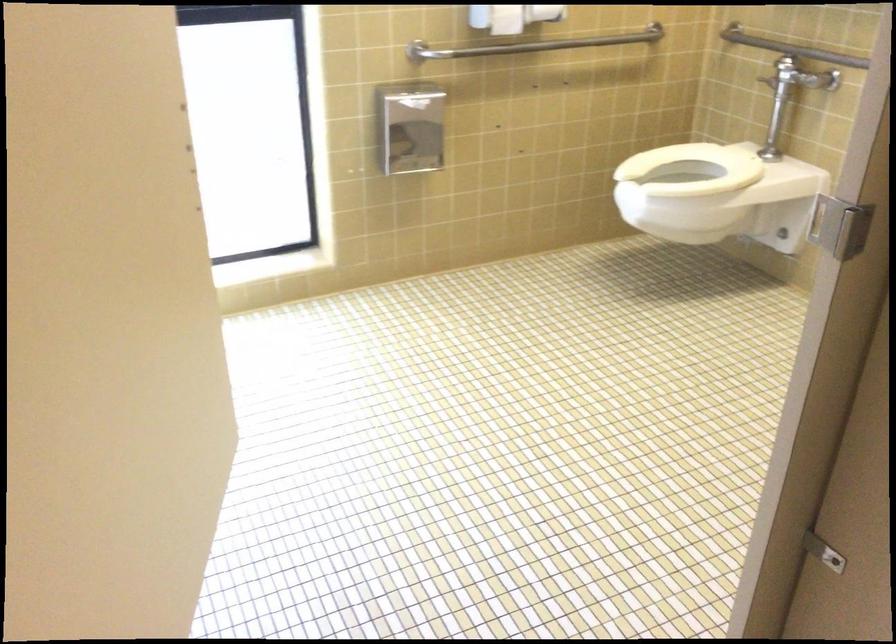
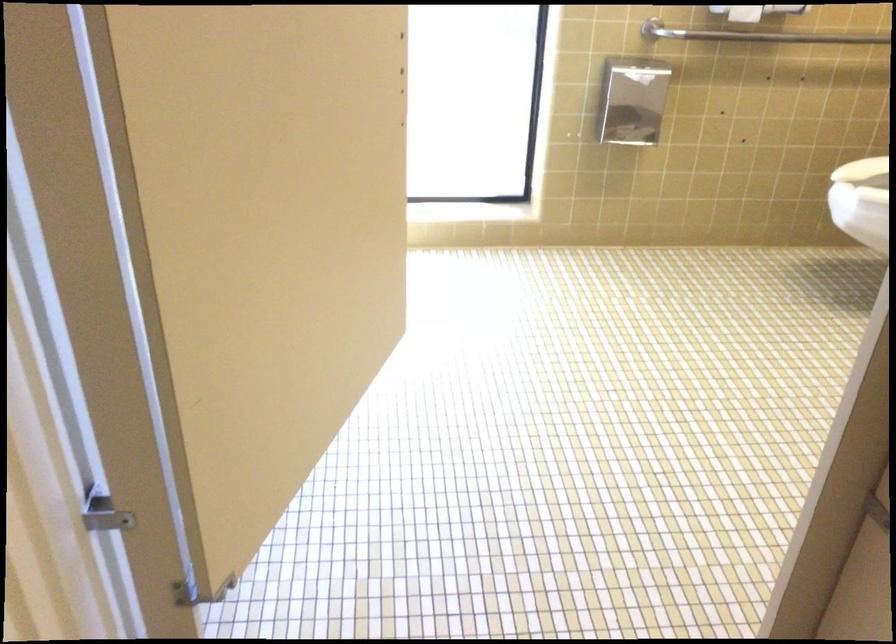
What movement of the cameraman would produce the second image?

The cameraman walked toward right, backward.